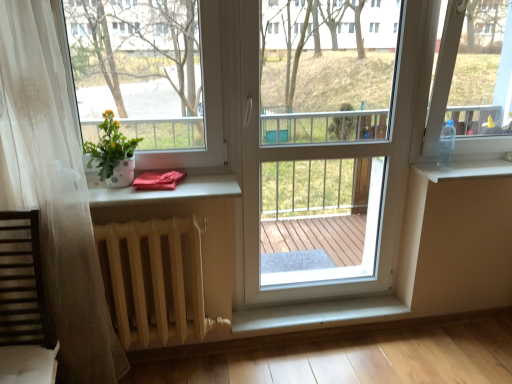
Identify the location of vacant region below transparent plastic bottle at right, positioned as the first window screen in right-to-left order (from a real-world perspective). (478, 163).